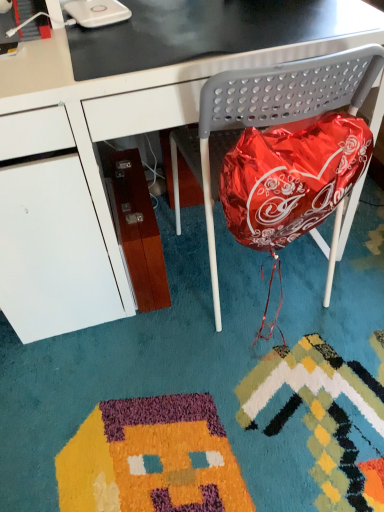
What do you see at coordinates (182, 46) in the screenshot? I see `black glossy table at upper center` at bounding box center [182, 46].

The width and height of the screenshot is (384, 512). Identify the location of metallic gray folding chair at center. (279, 108).

What do you see at coordinates (279, 108) in the screenshot? I see `metallic gray folding chair at center` at bounding box center [279, 108].

In order to face black glossy desk at center, should I rotate leftwards or rightwards?

Rotate your view left by about 5.594°.

The image size is (384, 512). Describe the element at coordinates (122, 134) in the screenshot. I see `black glossy desk at center` at that location.

Find the location of `black glossy table at upper center`. black glossy table at upper center is located at coordinates (182, 46).

Which of these two, metallic gray folding chair at center or black glossy desk at center, is thinner?

metallic gray folding chair at center is thinner.

Based on the photo, is the surface of metallic gray folding chair at center in direct contact with black glossy desk at center?

No, metallic gray folding chair at center is not in contact with black glossy desk at center.

From the image's perspective, is metallic gray folding chair at center located above or below black glossy desk at center?

Clearly, from the image's perspective, metallic gray folding chair at center is below black glossy desk at center.

Could you tell me if black glossy desk at center is facing metallic gray folding chair at center?

Yes, black glossy desk at center is facing metallic gray folding chair at center.

Can you confirm if black glossy desk at center is thinner than metallic gray folding chair at center?

In fact, black glossy desk at center might be wider than metallic gray folding chair at center.

Is black glossy desk at center located outside metallic gray folding chair at center?

black glossy desk at center is positioned outside metallic gray folding chair at center.

Who is smaller, black glossy table at upper center or metallic gray folding chair at center?

black glossy table at upper center is smaller.

What's the angular difference between black glossy table at upper center and metallic gray folding chair at center's facing directions?

The facing directions of black glossy table at upper center and metallic gray folding chair at center are 179 degrees apart.

Considering the sizes of objects black glossy table at upper center and metallic gray folding chair at center in the image provided, who is taller, black glossy table at upper center or metallic gray folding chair at center?

With more height is metallic gray folding chair at center.

This screenshot has width=384, height=512. In order to click on table top above the metallic gray folding chair at center (from a real-world perspective) in this screenshot , I will do `click(182, 46)`.

Is metallic gray folding chair at center in contact with black glossy table at upper center?

No, metallic gray folding chair at center is not with black glossy table at upper center.

From a real-world perspective, is metallic gray folding chair at center on black glossy table at upper center?

No, from a real-world perspective, metallic gray folding chair at center is not above black glossy table at upper center.

Does metallic gray folding chair at center turn towards black glossy table at upper center?

A: No.

Which is more to the left, black glossy desk at center or black glossy table at upper center?

black glossy desk at center.

Is black glossy desk at center not near black glossy table at upper center?

Actually, black glossy desk at center and black glossy table at upper center are a little close together.

Which of these two, black glossy desk at center or black glossy table at upper center, stands shorter?

black glossy table at upper center.

Consider the image. From a real-world perspective, is black glossy desk at center positioned over black glossy table at upper center based on gravity?

No.

Considering the relative sizes of black glossy table at upper center and black glossy desk at center in the image provided, is black glossy table at upper center wider than black glossy desk at center?

No, black glossy table at upper center is not wider than black glossy desk at center.

Considering the relative positions of black glossy table at upper center and black glossy desk at center in the image provided, is black glossy table at upper center behind black glossy desk at center?

Yes, it is behind black glossy desk at center.

Consider the image. From the image's perspective, between black glossy table at upper center and black glossy desk at center, which one is located above?

black glossy table at upper center.

From a real-world perspective, who is located higher, black glossy table at upper center or black glossy desk at center?

black glossy table at upper center, from a real-world perspective.

At what (x,y) coordinates should I click in order to perform the action: click on folding chair located below the black glossy desk at center (from the image's perspective). Please return your answer as a coordinate pair (x, y). The image size is (384, 512). Looking at the image, I should click on (279, 108).

Locate an element on the screen. desk located above the metallic gray folding chair at center (from a real-world perspective) is located at coordinates (122, 134).

From the picture: Based on their spatial positions, is metallic gray folding chair at center or black glossy desk at center closer to black glossy table at upper center?

black glossy desk at center is closer to black glossy table at upper center.

Based on their spatial positions, is black glossy table at upper center or black glossy desk at center closer to metallic gray folding chair at center?

Among the two, black glossy table at upper center is located nearer to metallic gray folding chair at center.

From the image, which object appears to be farther from black glossy table at upper center, black glossy desk at center or metallic gray folding chair at center?

metallic gray folding chair at center is positioned further to the anchor black glossy table at upper center.

When comparing their distances from black glossy desk at center, does black glossy table at upper center or metallic gray folding chair at center seem closer?

Among the two, black glossy table at upper center is located nearer to black glossy desk at center.

When comparing their distances from black glossy desk at center, does metallic gray folding chair at center or black glossy table at upper center seem closer?

Based on the image, black glossy table at upper center appears to be nearer to black glossy desk at center.

Estimate the real-world distances between objects in this image. Which object is further from metallic gray folding chair at center, black glossy desk at center or black glossy table at upper center?

black glossy desk at center is positioned further to the anchor metallic gray folding chair at center.

Where is `desk between black glossy table at upper center and metallic gray folding chair at center from top to bottom`? This screenshot has height=512, width=384. desk between black glossy table at upper center and metallic gray folding chair at center from top to bottom is located at coordinates (122, 134).